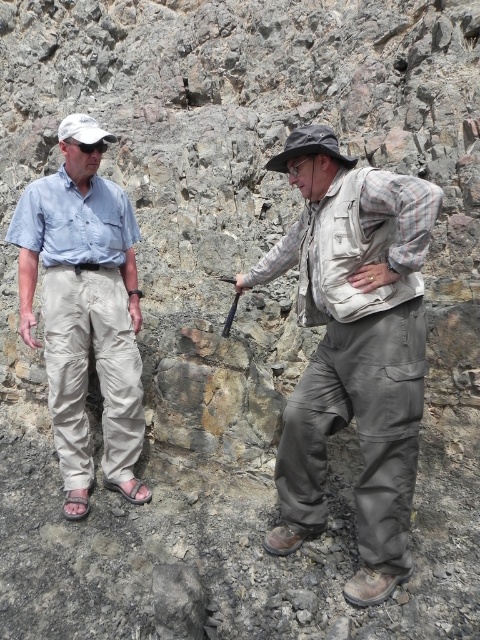
Is point (367, 573) positioned before point (25, 314)?

Yes, point (367, 573) is in front of point (25, 314).

What do you see at coordinates (354, 348) in the screenshot? I see `camouflage fabric shirt at center` at bounding box center [354, 348].

The image size is (480, 640). In order to click on camouflage fabric shirt at center in this screenshot , I will do `click(354, 348)`.

Between khaki cotton pants at center and light blue cotton shirt at center, which one has less height?

light blue cotton shirt at center

Who is positioned more to the right, khaki cotton pants at center or light blue cotton shirt at center?

From the viewer's perspective, khaki cotton pants at center appears more on the right side.

Where is `khaki cotton pants at center`? This screenshot has height=640, width=480. khaki cotton pants at center is located at coordinates (352, 348).

Which is in front, point (383, 448) or point (377, 454)?

Point (383, 448) is in front.

This screenshot has height=640, width=480. I want to click on khaki cotton pants at center, so click(352, 348).

This screenshot has height=640, width=480. In order to click on khaki cotton pants at center in this screenshot , I will do `click(352, 348)`.